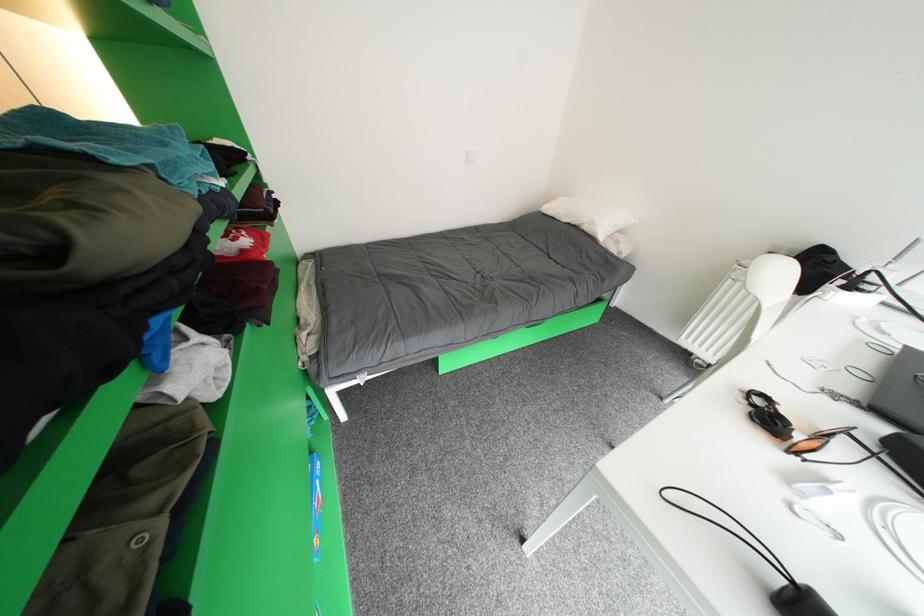
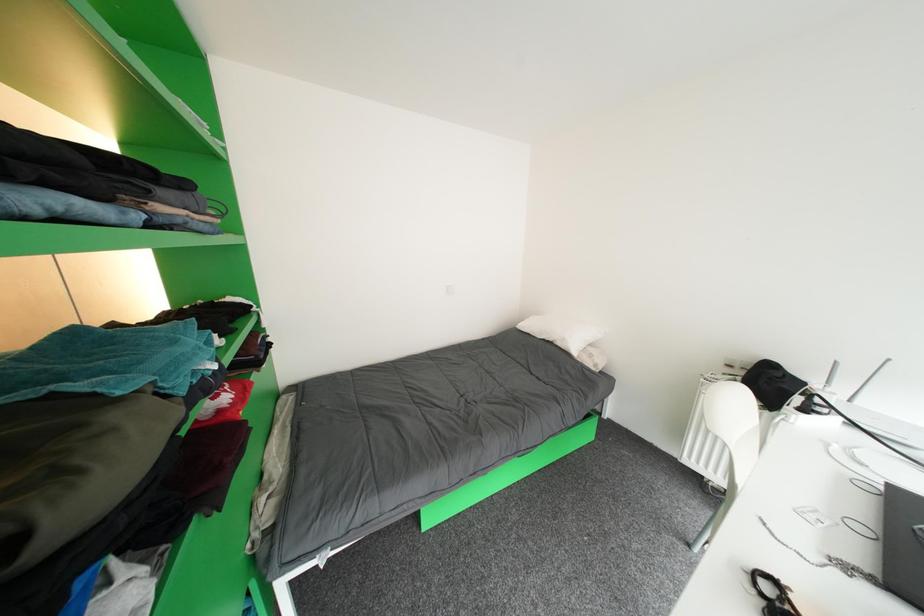
In a continuous first-person perspective shot, in which direction is the camera moving?

The movement direction of the cameraman is right, backward.